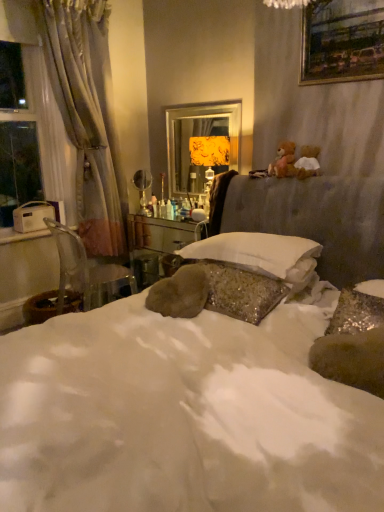
Question: Considering the relative sizes of wooden vanity at center and metallic gold mirror at center in the image provided, is wooden vanity at center taller than metallic gold mirror at center?

Choices:
 (A) no
 (B) yes

Answer: (A)

Question: Is wooden vanity at center facing towards metallic gold mirror at center?

Choices:
 (A) yes
 (B) no

Answer: (B)

Question: Is wooden vanity at center looking in the opposite direction of metallic gold mirror at center?

Choices:
 (A) no
 (B) yes

Answer: (A)

Question: From the image's perspective, would you say wooden vanity at center is shown under metallic gold mirror at center?

Choices:
 (A) yes
 (B) no

Answer: (A)

Question: Is the depth of wooden vanity at center greater than that of metallic gold mirror at center?

Choices:
 (A) no
 (B) yes

Answer: (A)

Question: Does wooden vanity at center appear on the left side of metallic gold mirror at center?

Choices:
 (A) no
 (B) yes

Answer: (B)

Question: Is transparent glass window at left smaller than clear plastic chair at left?

Choices:
 (A) yes
 (B) no

Answer: (B)

Question: Does transparent glass window at left have a lesser width compared to clear plastic chair at left?

Choices:
 (A) no
 (B) yes

Answer: (B)

Question: Would you consider transparent glass window at left to be distant from clear plastic chair at left?

Choices:
 (A) yes
 (B) no

Answer: (B)

Question: Is transparent glass window at left outside of clear plastic chair at left?

Choices:
 (A) no
 (B) yes

Answer: (B)

Question: From a real-world perspective, is transparent glass window at left over clear plastic chair at left?

Choices:
 (A) no
 (B) yes

Answer: (B)

Question: Is transparent glass window at left wider than clear plastic chair at left?

Choices:
 (A) yes
 (B) no

Answer: (B)

Question: From a real-world perspective, is gold-framed painting at upper right positioned over clear plastic chair at left based on gravity?

Choices:
 (A) no
 (B) yes

Answer: (B)